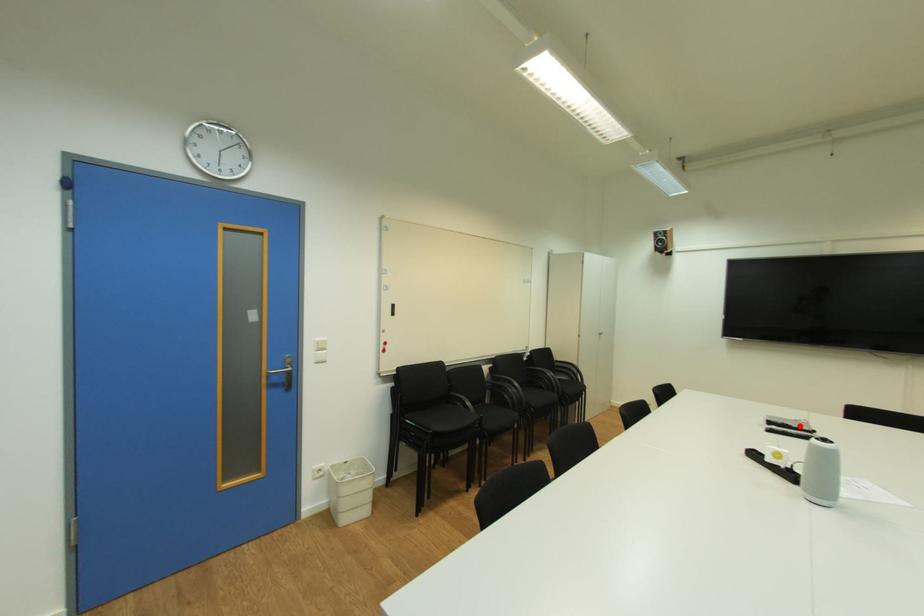
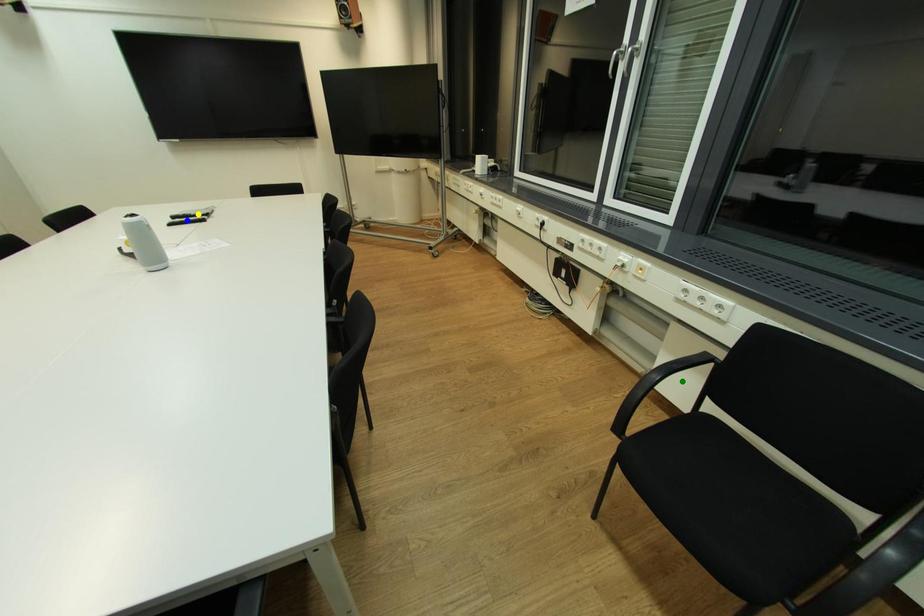
Question: I am providing you with two images of the same scene from different viewpoints. A red point is marked on the first image. You are given multiple points on the second image. Which mark in image 2 goes with the point in image 1?

Choices:
 (A) blue point
 (B) yellow point
 (C) green point

Answer: (B)